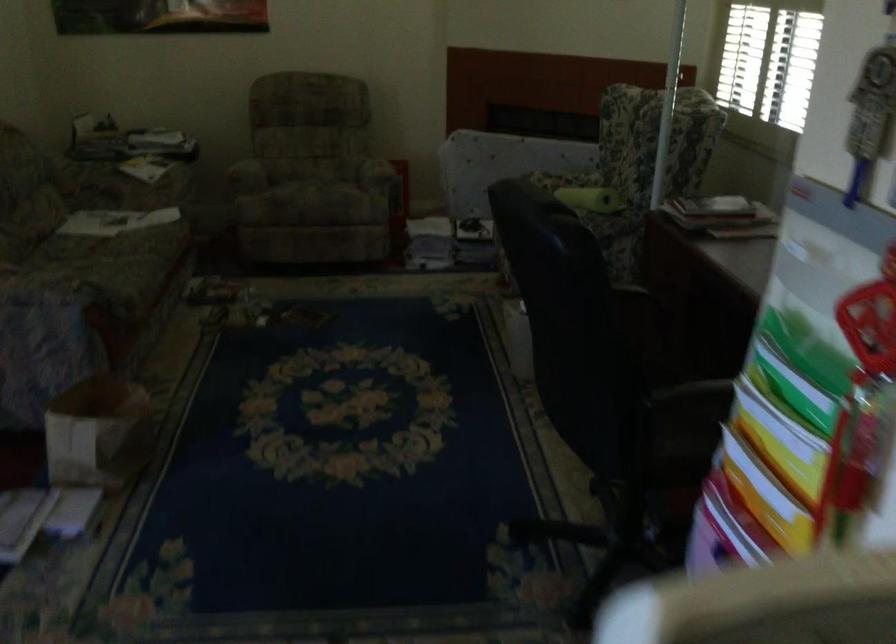
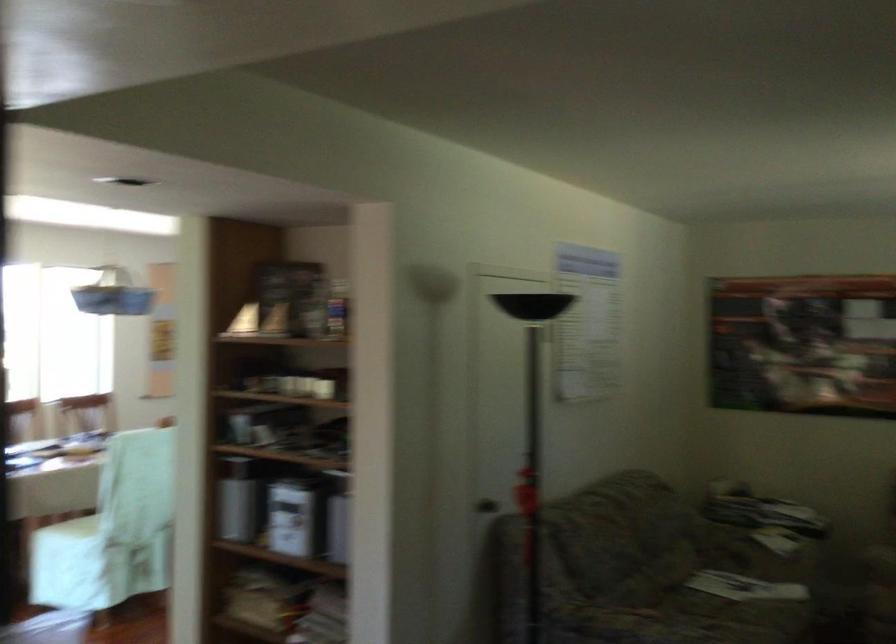
The images are taken continuously from a first-person perspective. In which direction is your viewpoint rotating?

The camera rotated toward left-up.